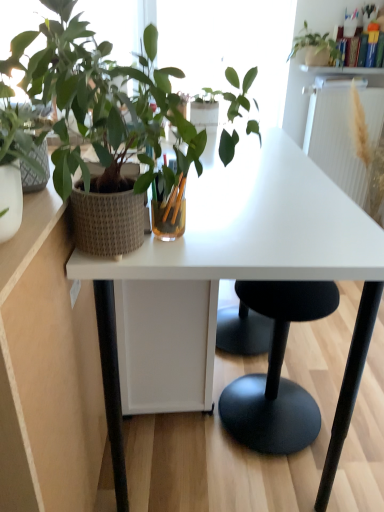
Question: From a real-world perspective, relative to textured woven pot at left, placed as the 1th houseplant when sorted from left to right, is matte white pot at upper right, marked as the 1th houseplant in a back-to-front arrangement, vertically above or below?

Choices:
 (A) above
 (B) below

Answer: (A)

Question: Would you say matte white pot at upper right, placed as the first houseplant when sorted from right to left, is to the left or to the right of textured woven pot at left, acting as the 2th houseplant starting from the back, in the picture?

Choices:
 (A) right
 (B) left

Answer: (A)

Question: Which is farther from the matte white pot at upper right, placed as the first houseplant when sorted from right to left?

Choices:
 (A) white matte desk at center
 (B) black matte stool at center
 (C) white textured radiator at upper right
 (D) textured woven pot at left, the 1th houseplant when ordered from bottom to top
 (E) white glossy shelf at upper center

Answer: (D)

Question: Which is farther from the black matte stool at center?

Choices:
 (A) white matte desk at center
 (B) white textured radiator at upper right
 (C) white glossy shelf at upper center
 (D) matte white pot at upper right, the 1th houseplant positioned from the top
 (E) textured woven pot at left, acting as the 2th houseplant starting from the back

Answer: (C)